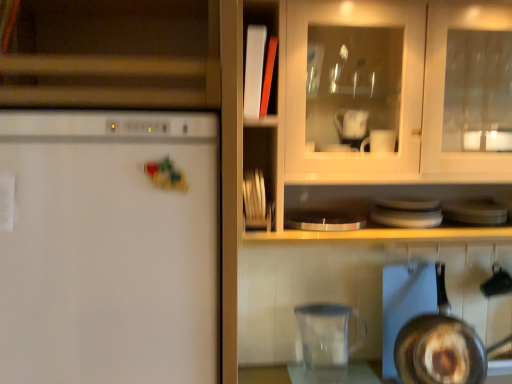
Question: From their relative heights in the image, would you say shiny silver frying pan at lower right is taller or shorter than white matte refrigerator at left?

Choices:
 (A) short
 (B) tall

Answer: (A)

Question: From a real-world perspective, is shiny silver frying pan at lower right positioned above or below white matte refrigerator at left?

Choices:
 (A) above
 (B) below

Answer: (B)

Question: Considering the real-world distances, which object is farthest from the white matte refrigerator at left?

Choices:
 (A) matte wood cabinet at upper left
 (B) transparent plastic pitcher at lower center
 (C) shiny silver frying pan at lower right

Answer: (C)

Question: Estimate the real-world distances between objects in this image. Which object is farther from the white matte refrigerator at left?

Choices:
 (A) transparent plastic pitcher at lower center
 (B) matte wood cabinet at upper left
 (C) shiny silver frying pan at lower right

Answer: (C)